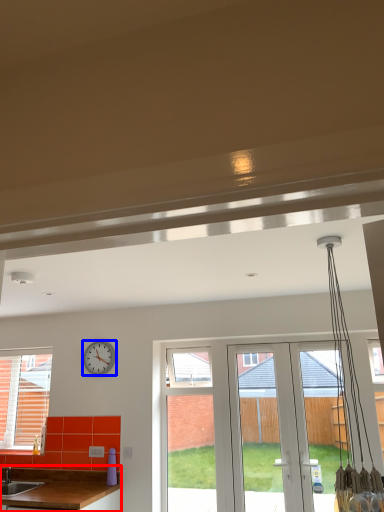
Question: Which point is closer to the camera, countertop (highlighted by a red box) or clock (highlighted by a blue box)?

Choices:
 (A) countertop
 (B) clock

Answer: (A)